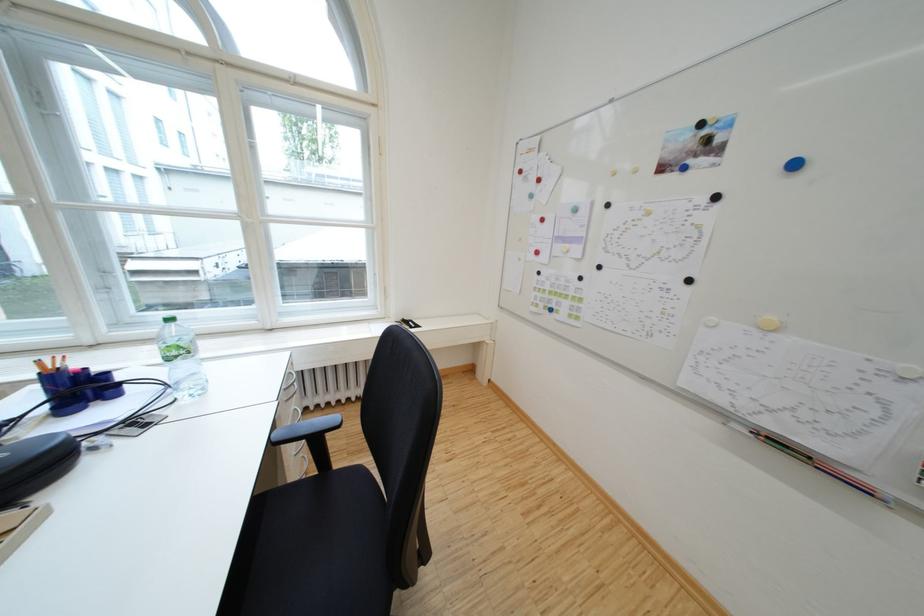
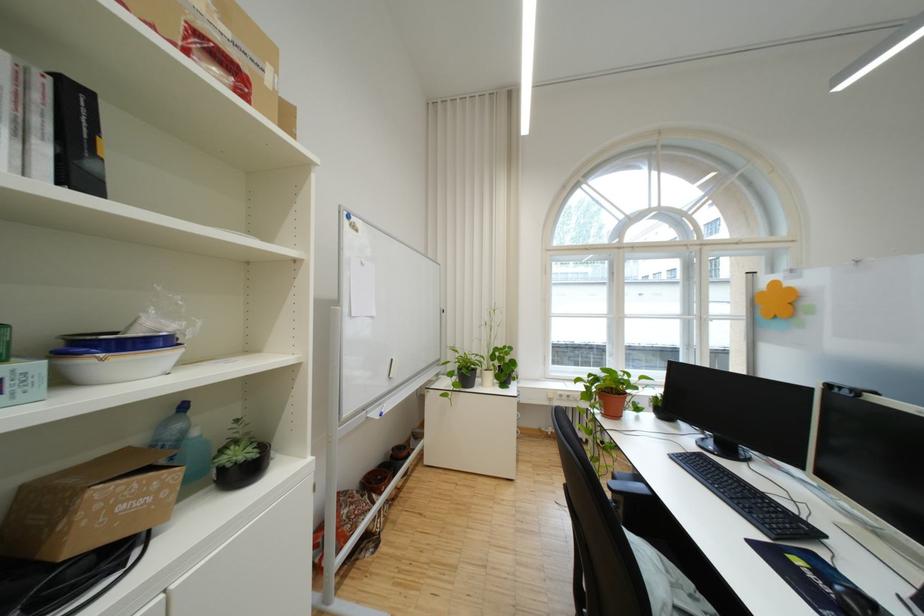
Question: I am providing you with two images of the same scene from different viewpoints. Which of the following objects are not visible in image2?

Choices:
 (A) plastic water bottle
 (B) white and blue bowl
 (C) black computer mouse
 (D) round metal tin

Answer: (A)